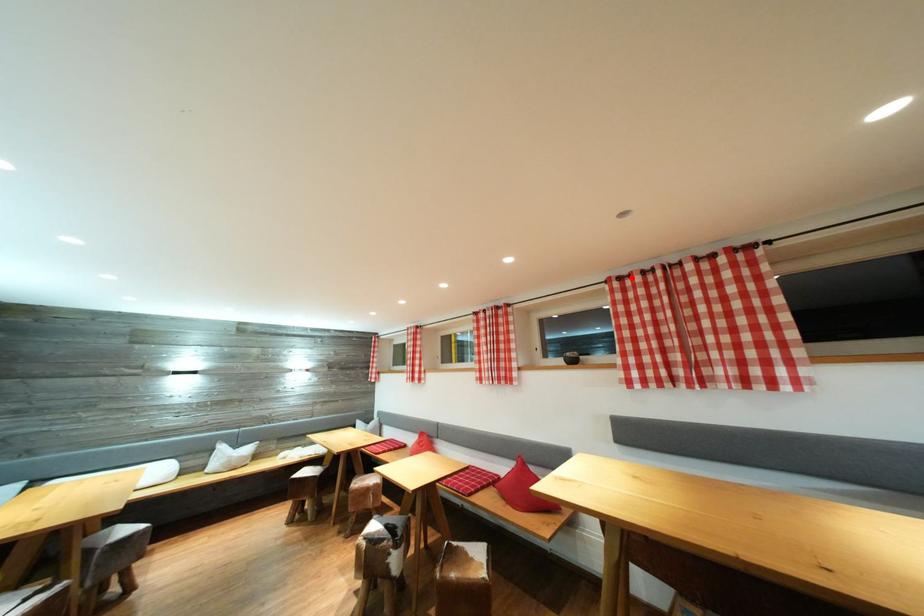
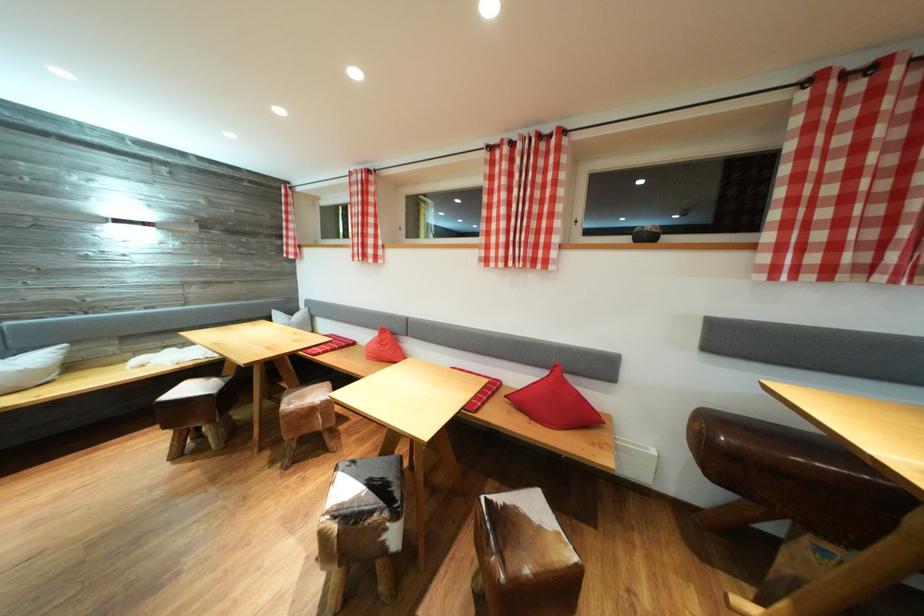
Find the pixel in the second image that matches the highlighted location in the first image.

(869, 66)